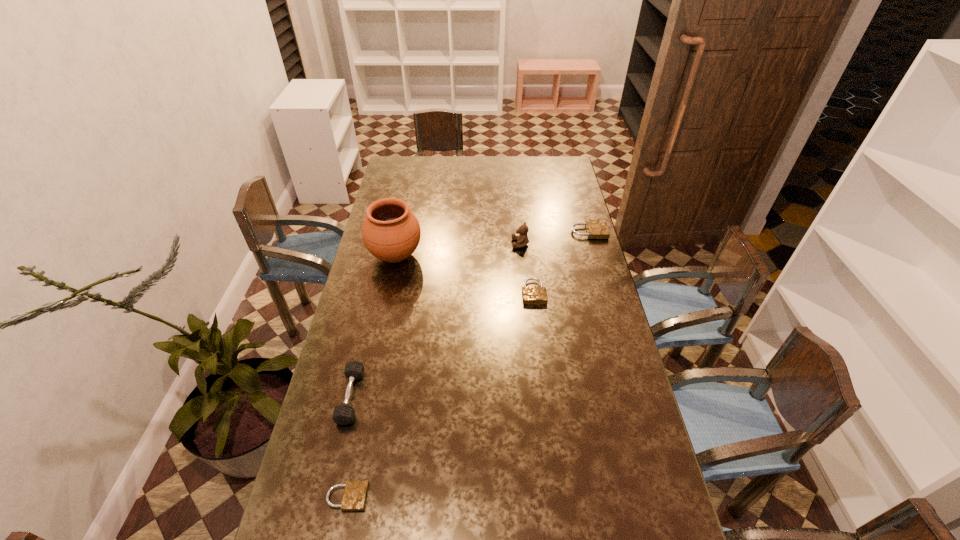
I want to click on the leftmost padlock, so click(355, 494).

This screenshot has width=960, height=540. I want to click on the shortest object, so click(355, 494).

At what (x,y) coordinates should I click in order to perform the action: click on the second padlock from right to left. Please return your answer as a coordinate pair (x, y). This screenshot has height=540, width=960. Looking at the image, I should click on (532, 295).

Where is `the second shortest object`? The height and width of the screenshot is (540, 960). the second shortest object is located at coordinates (532, 295).

The width and height of the screenshot is (960, 540). What are the coordinates of `the tallest padlock` in the screenshot? It's located at point(596,229).

Where is `the fourth tallest object`? the fourth tallest object is located at coordinates (596, 229).

Where is `the tallest object`? The height and width of the screenshot is (540, 960). the tallest object is located at coordinates (390, 232).

The width and height of the screenshot is (960, 540). I want to click on teddy bear, so click(522, 240).

I want to click on dumbbell, so click(x=343, y=414).

This screenshot has width=960, height=540. What are the coordinates of `the fifth farthest object` in the screenshot? It's located at (343, 414).